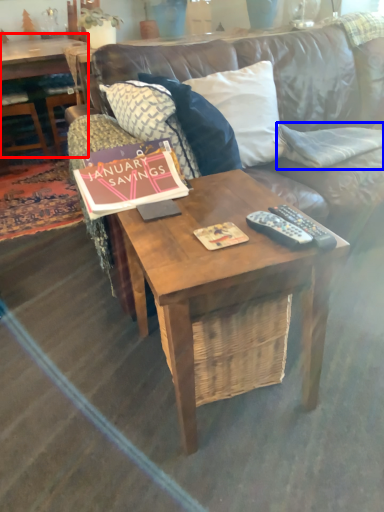
Question: Which point is closer to the camera, coffee table (highlighted by a red box) or pillow (highlighted by a blue box)?

Choices:
 (A) coffee table
 (B) pillow

Answer: (B)